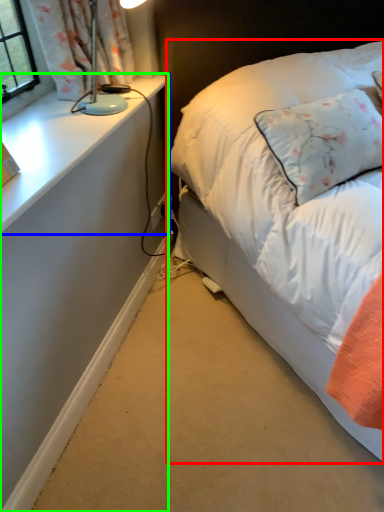
Question: Considering the real-world distances, which object is closest to bed (highlighted by a red box)? table (highlighted by a blue box) or desk (highlighted by a green box).

Choices:
 (A) table
 (B) desk

Answer: (B)